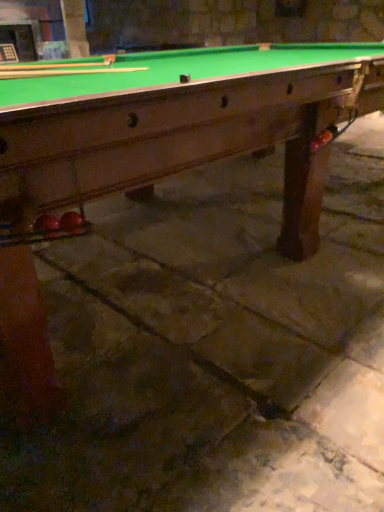
Question: Is wooden cue at upper left, which is counted as the 1th cue, starting from the back, at the right side of wooden cue at upper left, arranged as the first cue when viewed from the front?

Choices:
 (A) no
 (B) yes

Answer: (B)

Question: Is wooden cue at upper left, marked as the 2th cue in a front-to-back arrangement, turned away from wooden cue at upper left, the 2th cue when ordered from back to front?

Choices:
 (A) yes
 (B) no

Answer: (B)

Question: From a real-world perspective, does wooden cue at upper left, which is counted as the 1th cue, starting from the back, sit lower than wooden cue at upper left, the 2th cue when ordered from back to front?

Choices:
 (A) no
 (B) yes

Answer: (B)

Question: From the image's perspective, is wooden cue at upper left, marked as the 2th cue in a front-to-back arrangement, on top of wooden cue at upper left, arranged as the first cue when viewed from the front?

Choices:
 (A) no
 (B) yes

Answer: (A)

Question: Considering the relative sizes of wooden cue at upper left, marked as the 2th cue in a front-to-back arrangement, and wooden cue at upper left, arranged as the first cue when viewed from the front, in the image provided, is wooden cue at upper left, marked as the 2th cue in a front-to-back arrangement, shorter than wooden cue at upper left, arranged as the first cue when viewed from the front,?

Choices:
 (A) no
 (B) yes

Answer: (B)

Question: Is wooden cue at upper left, marked as the 2th cue in a front-to-back arrangement, wider than wooden cue at upper left, the 2th cue when ordered from back to front?

Choices:
 (A) no
 (B) yes

Answer: (B)

Question: From the image's perspective, is wooden cue at upper left, arranged as the first cue when viewed from the front, under wooden cue at upper left, which is counted as the 1th cue, starting from the back?

Choices:
 (A) no
 (B) yes

Answer: (A)

Question: Can you confirm if wooden cue at upper left, the 2th cue when ordered from back to front, is bigger than wooden cue at upper left, which is counted as the 1th cue, starting from the back?

Choices:
 (A) yes
 (B) no

Answer: (A)

Question: Does wooden cue at upper left, arranged as the first cue when viewed from the front, have a greater height compared to wooden cue at upper left, marked as the 2th cue in a front-to-back arrangement?

Choices:
 (A) yes
 (B) no

Answer: (A)

Question: Could you tell me if wooden cue at upper left, arranged as the first cue when viewed from the front, is turned towards wooden cue at upper left, which is counted as the 1th cue, starting from the back?

Choices:
 (A) no
 (B) yes

Answer: (A)

Question: Does wooden cue at upper left, the 2th cue when ordered from back to front, have a lesser height compared to wooden cue at upper left, marked as the 2th cue in a front-to-back arrangement?

Choices:
 (A) yes
 (B) no

Answer: (B)

Question: From a real-world perspective, does wooden cue at upper left, the 2th cue when ordered from back to front, sit lower than wooden cue at upper left, which is counted as the 1th cue, starting from the back?

Choices:
 (A) yes
 (B) no

Answer: (B)

Question: Is wooden cue at upper left, arranged as the first cue when viewed from the front, taller or shorter than wooden cue at upper left, marked as the 2th cue in a front-to-back arrangement?

Choices:
 (A) tall
 (B) short

Answer: (A)